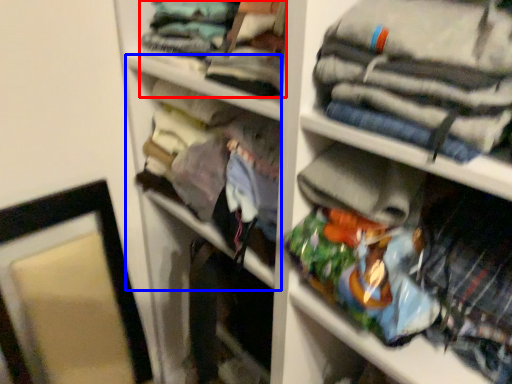
Question: Which object appears closest to the camera in this image, clothing (highlighted by a red box) or cabinet (highlighted by a blue box)?

Choices:
 (A) clothing
 (B) cabinet

Answer: (A)